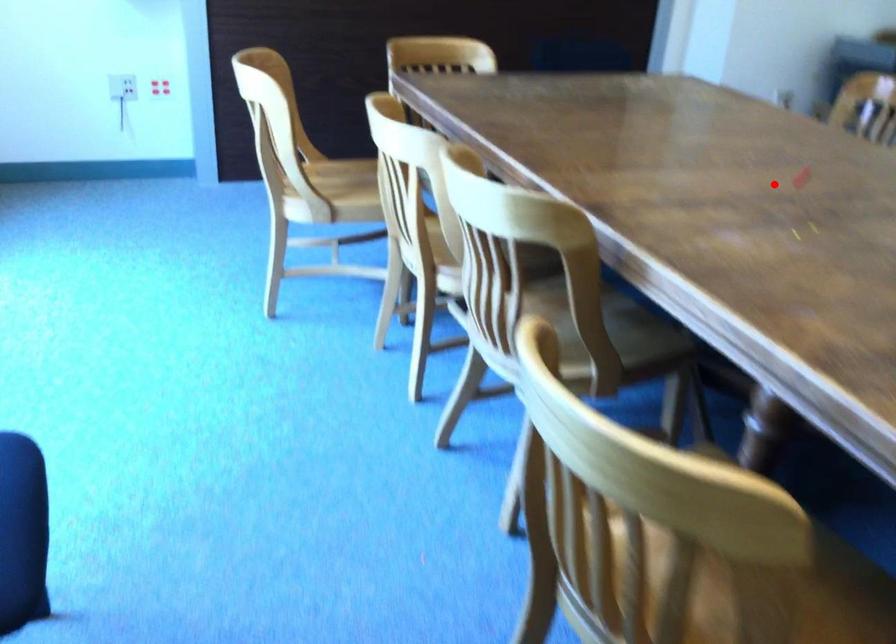
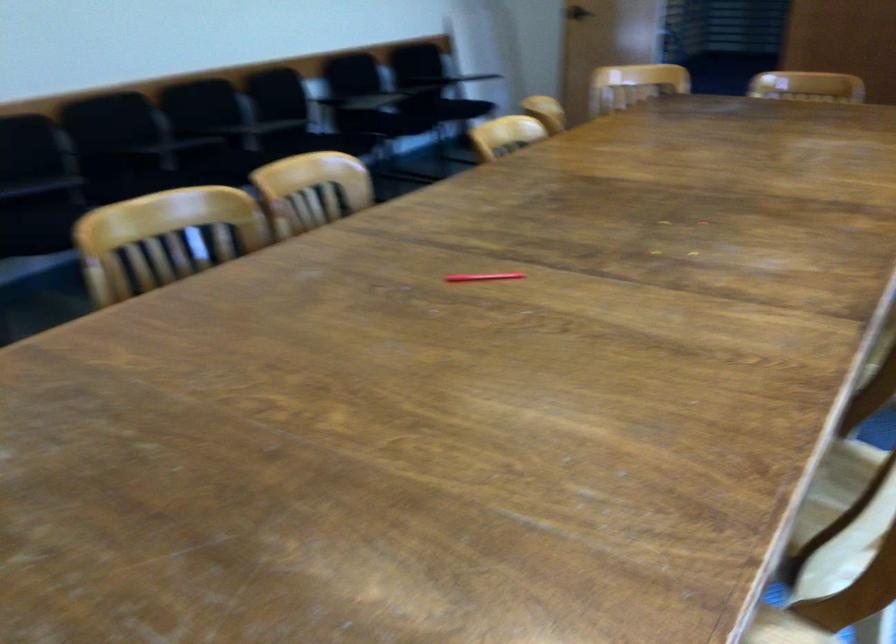
Question: I am providing you with two images of the same scene from different viewpoints. Given a red point in image1, look at the same physical point in image2. Is it:

Choices:
 (A) Closer to the viewpoint
 (B) Farther from the viewpoint

Answer: (A)